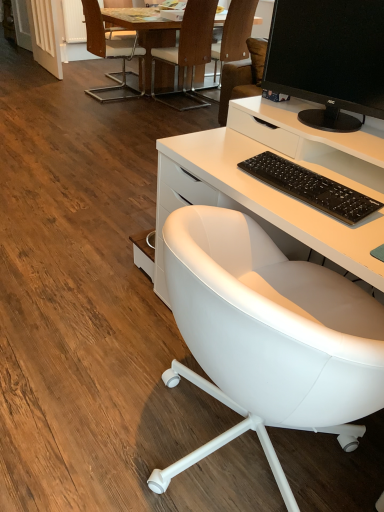
Locate an element on the screen. This screenshot has height=512, width=384. free point above black matte keyboard at center (from a real-world perspective) is located at coordinates (324, 181).